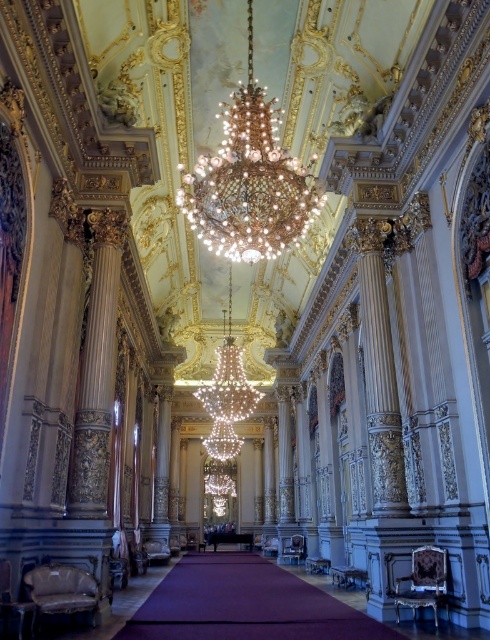
Question: Is gold-carved column at center positioned before gold ornate column at center?

Choices:
 (A) yes
 (B) no

Answer: (A)

Question: Can you confirm if shiny crystal chandelier at center is positioned to the right of gold ornate column at center?

Choices:
 (A) no
 (B) yes

Answer: (A)

Question: Which point is farther to the camera?

Choices:
 (A) (368, 280)
 (B) (284, 152)

Answer: (A)

Question: Which point is farther to the camera?

Choices:
 (A) (x=242, y=92)
 (B) (x=67, y=497)

Answer: (A)

Question: Is shiny crystal chandelier at center wider than gold ornate column at center?

Choices:
 (A) no
 (B) yes

Answer: (B)

Question: Which point is farther from the camera taking this photo?

Choices:
 (A) (92, 380)
 (B) (372, 310)
 (C) (272, 211)

Answer: (B)